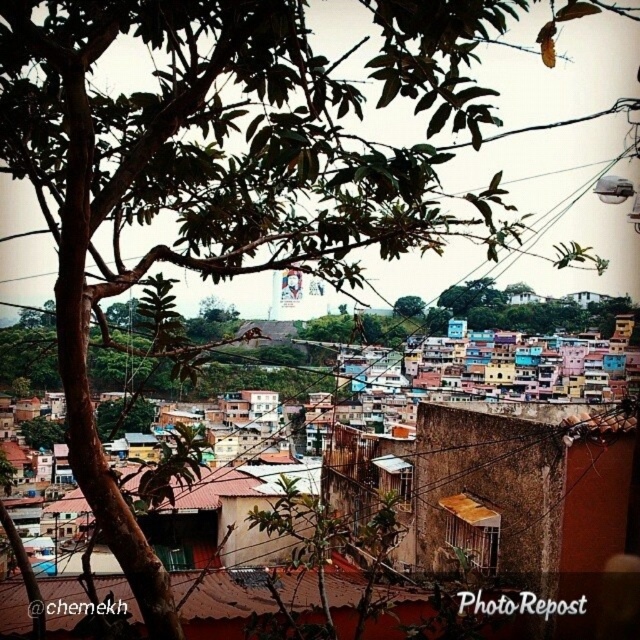
From the picture: You are standing on a rooftop and looking at the city. There are two points in the scene labeled as point 1 and point 2. Point 1 is at coordinates point [502,449] and point 2 is at coordinates point [406,301]. Which point is closer to you?

Point [502,449] is closer to the camera than point [406,301].

You are a drone operator trying to capture a photo of the brown textured wall at center. The drone has a camera with a fixed focal length. To ensure the wall is in the center of the photo, where should you position the drone relative to the wall?

The brown textured wall at center is located at coordinates point (508, 481), so the drone should be positioned directly above the wall at those coordinates to center it in the photo.

You are an architect designing a new building and want to ensure it blends with the existing cityscape. Based on the image, which object would you reference for size comparison between the brown textured wall at center and the green leafy tree at center?

The brown textured wall at center is larger in size than the green leafy tree at center, so referencing the wall would provide a better size comparison for the new building design.